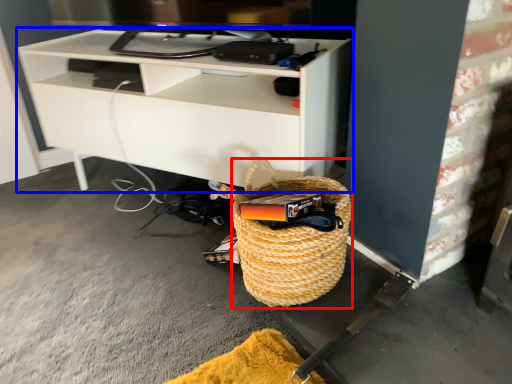
Question: Which point is further to the camera, basket (highlighted by a red box) or shelf (highlighted by a blue box)?

Choices:
 (A) basket
 (B) shelf

Answer: (B)